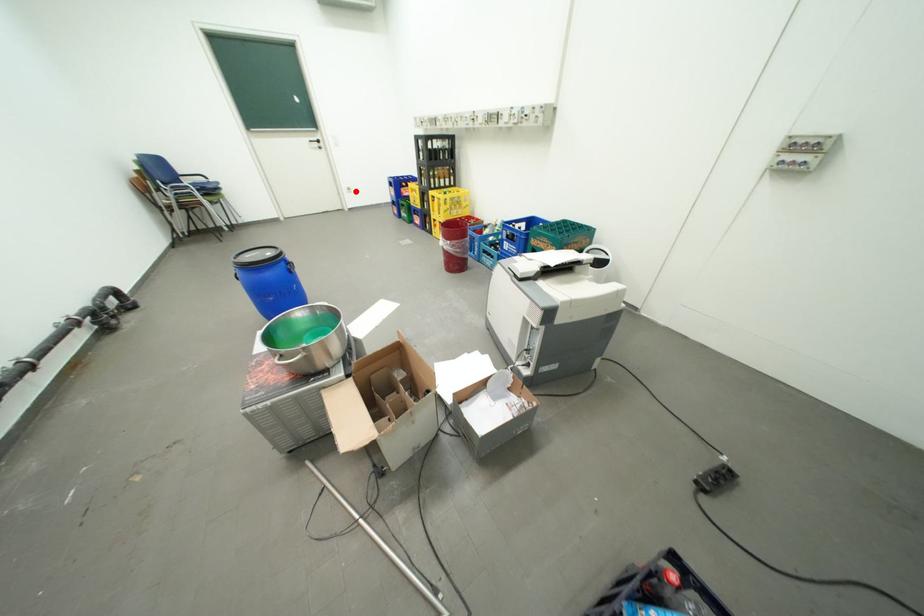
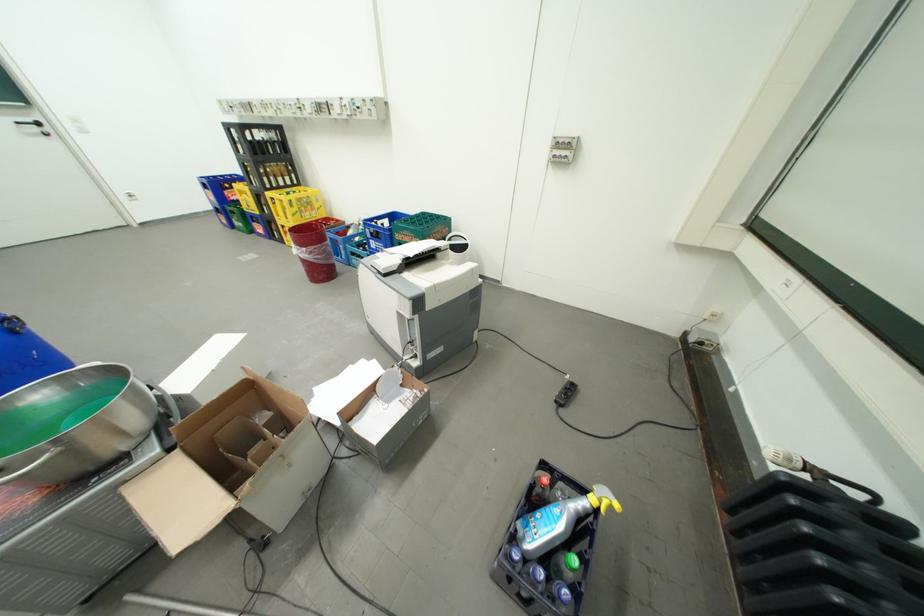
Locate, in the second image, the point that corresponds to the highlighted location in the first image.

(134, 199)